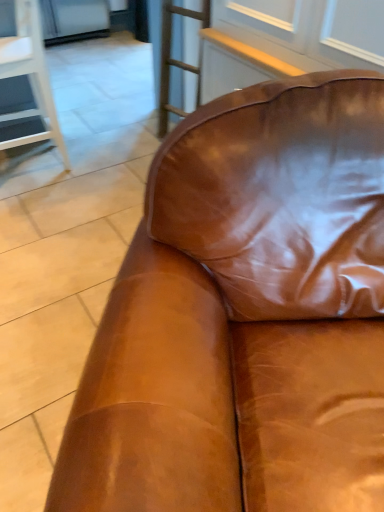
What do you see at coordinates (30, 77) in the screenshot? I see `white painted wood bar stool at left` at bounding box center [30, 77].

Identify the location of white painted wood bar stool at left. The image size is (384, 512). (30, 77).

Identify the location of white painted wood bar stool at left. This screenshot has height=512, width=384. (30, 77).